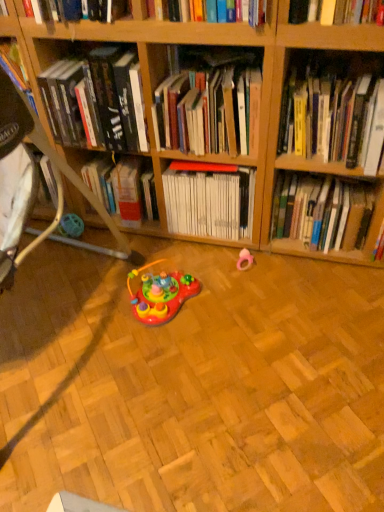
Image resolution: width=384 pixels, height=512 pixels. Find the location of `free location to the left of pink rubber ring at center, which is the first toy in right-to-left order`. free location to the left of pink rubber ring at center, which is the first toy in right-to-left order is located at coordinates (212, 267).